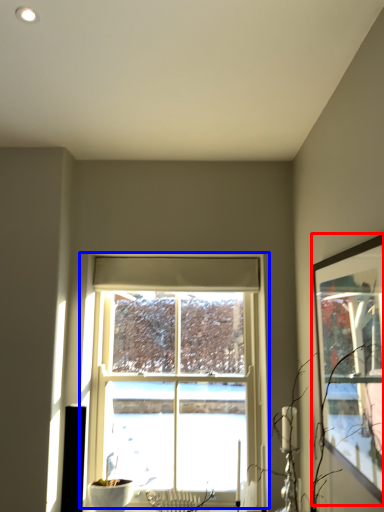
Question: Which of the following is the farthest to the observer, picture frame (highlighted by a red box) or window (highlighted by a blue box)?

Choices:
 (A) picture frame
 (B) window

Answer: (B)